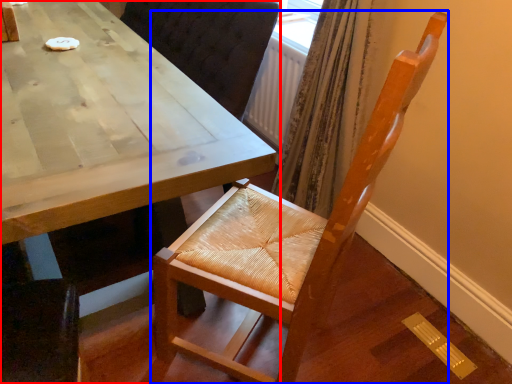
Question: Which point is closer to the camera, table (highlighted by a red box) or chair (highlighted by a blue box)?

Choices:
 (A) table
 (B) chair

Answer: (B)